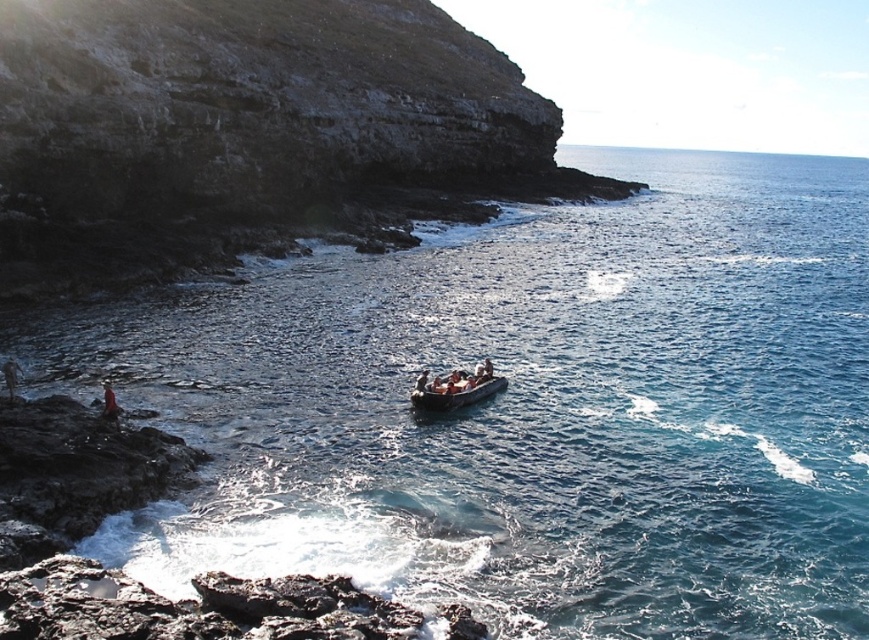
Is smooth gray boat at center to the right of red fabric person at lower left from the viewer's perspective?

Yes, smooth gray boat at center is to the right of red fabric person at lower left.

Between smooth gray boat at center and red fabric person at lower left, which one has more height?

With more height is smooth gray boat at center.

Between point (454, 385) and point (111, 417), which one is positioned behind?

The point (454, 385) is behind.

Locate an element on the screen. This screenshot has width=869, height=640. smooth gray boat at center is located at coordinates (456, 392).

Who is positioned more to the left, red fabric person at lower left or smooth skin person at center?

Positioned to the left is red fabric person at lower left.

Is the position of red fabric person at lower left more distant than that of smooth skin person at center?

No.

The width and height of the screenshot is (869, 640). What do you see at coordinates (109, 401) in the screenshot? I see `red fabric person at lower left` at bounding box center [109, 401].

Locate an element on the screen. Image resolution: width=869 pixels, height=640 pixels. red fabric person at lower left is located at coordinates (109, 401).

Identify the location of smooth gray boat at center. (456, 392).

Between point (448, 376) and point (416, 385), which one is positioned behind?

The point (448, 376) is behind.

At what (x,y) coordinates should I click in order to perform the action: click on smooth gray boat at center. Please return your answer as a coordinate pair (x, y). This screenshot has width=869, height=640. Looking at the image, I should click on (456, 392).

Where is `smooth gray boat at center`? smooth gray boat at center is located at coordinates (456, 392).